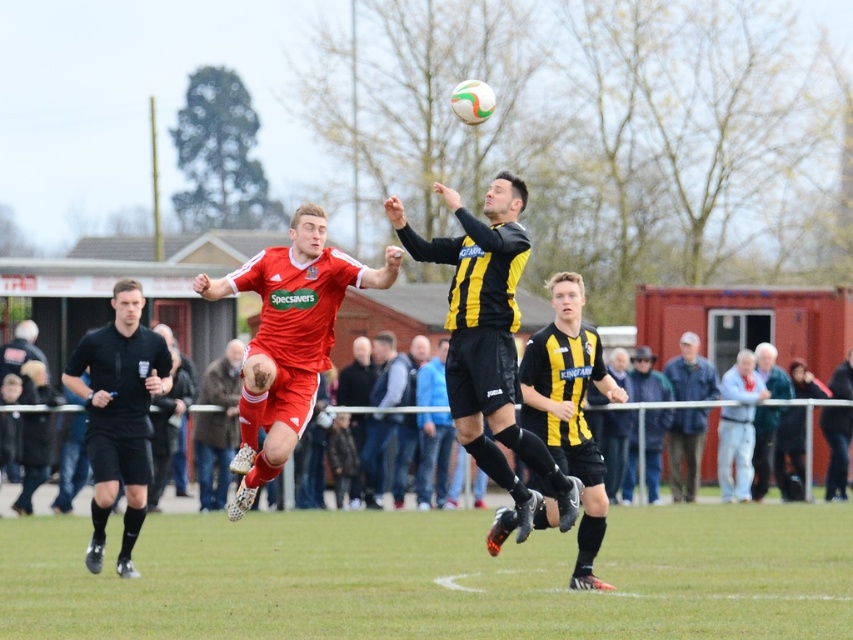
Is black/yellow jersey at center bigger than dark gray jacket at right?

Correct, black/yellow jersey at center is larger in size than dark gray jacket at right.

Who is positioned more to the right, black/yellow jersey at center or dark gray jacket at right?

From the viewer's perspective, dark gray jacket at right appears more on the right side.

Is point (424, 435) positioned before point (769, 449)?

Yes.

Find the location of a particular element. This screenshot has width=853, height=640. black/yellow jersey at center is located at coordinates click(433, 456).

Does matte red jersey at center have a greater height compared to blue denim jacket at lower right?

Incorrect, matte red jersey at center's height is not larger of blue denim jacket at lower right's.

Who is positioned more to the left, matte red jersey at center or blue denim jacket at lower right?

Positioned to the left is matte red jersey at center.

You are a GUI agent. You are given a task and a screenshot of the screen. Output one action in this format:
    pyautogui.click(x=<x>, y=<y>)
    Task: Click on the matte red jersey at center
    
    Given the screenshot: What is the action you would take?
    pyautogui.click(x=288, y=339)

Who is taller, black matte referee at left or blue jersey at center?

black matte referee at left is taller.

Does point (71, 365) come farther from viewer compared to point (405, 396)?

That is False.

Image resolution: width=853 pixels, height=640 pixels. I want to click on black matte referee at left, so click(x=119, y=413).